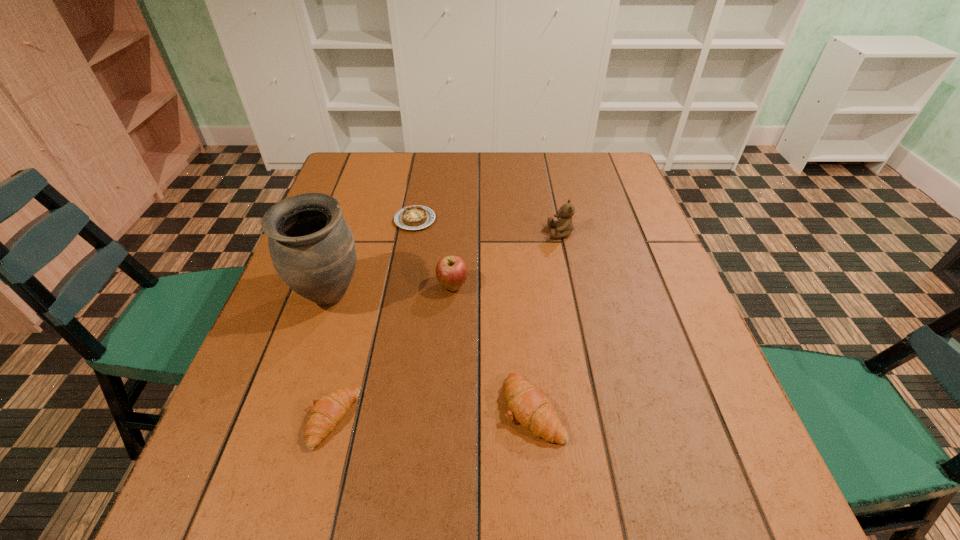
The width and height of the screenshot is (960, 540). I want to click on the second shortest object, so click(327, 411).

This screenshot has width=960, height=540. I want to click on the left crescent roll, so pyautogui.click(x=327, y=411).

The width and height of the screenshot is (960, 540). In order to click on the fifth object from left to right in this screenshot , I will do `click(529, 406)`.

This screenshot has height=540, width=960. Identify the location of the fourth tallest object. (529, 406).

I want to click on the rightmost object, so click(x=564, y=225).

In order to click on quiche in this screenshot , I will do `click(415, 217)`.

Locate an element on the screen. The width and height of the screenshot is (960, 540). the tallest object is located at coordinates (312, 248).

Locate an element on the screen. the third object from right to left is located at coordinates 451,271.

Locate an element on the screen. Image resolution: width=960 pixels, height=540 pixels. vacant space located 0.110m on the left of the fifth tallest object is located at coordinates (250, 420).

This screenshot has width=960, height=540. In order to click on free space located on the back of the taller crescent roll in this screenshot , I will do `click(518, 248)`.